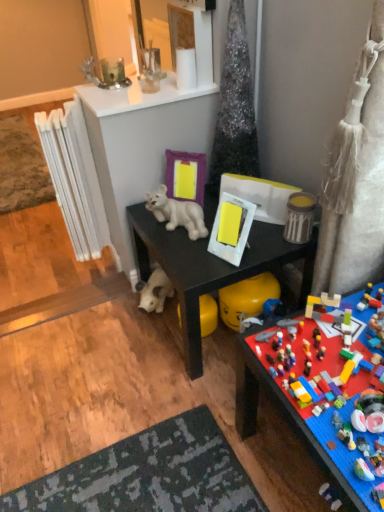
The image size is (384, 512). Find the location of `vacant position to the left of white plush toy at lower center, which is the 2th toy from bottom to top`. vacant position to the left of white plush toy at lower center, which is the 2th toy from bottom to top is located at coordinates (120, 316).